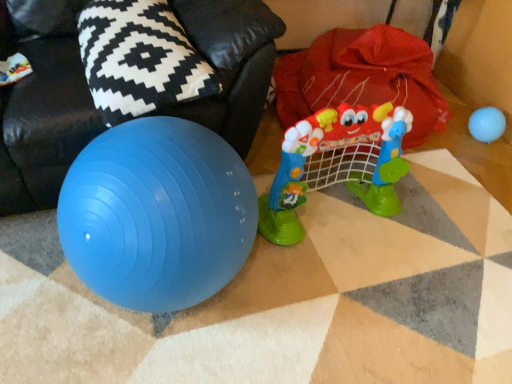
Question: From the image's perspective, is blue rubber ball at upper right, which appears as the 2th toy when viewed from the front, above or below plastic toy at center, the 2th toy viewed from the right?

Choices:
 (A) below
 (B) above

Answer: (B)

Question: Relative to plastic toy at center, the 2th toy viewed from the right, is blue rubber ball at upper right, positioned as the 1th toy in right-to-left order, in front or behind?

Choices:
 (A) behind
 (B) front

Answer: (A)

Question: Considering the real-world distances, which object is farthest from the black and white patterned pillow at upper left?

Choices:
 (A) red fabric bean bag at upper right
 (B) plastic toy at center, which is the first toy from left to right
 (C) blue rubber ball at upper right, positioned as the second toy in left-to-right order

Answer: (C)

Question: Which object is the closest to the red fabric bean bag at upper right?

Choices:
 (A) plastic toy at center, the 2th toy viewed from the right
 (B) blue rubber ball at upper right, positioned as the 1th toy in right-to-left order
 (C) black and white patterned pillow at upper left

Answer: (C)